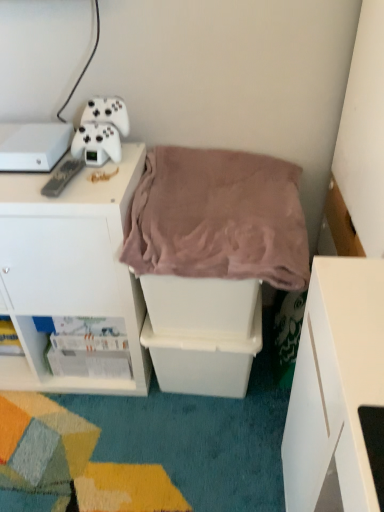
Question: From a real-world perspective, is white plastic storage bin at center, placed as the second shelf when sorted from left to right, physically located above or below white glossy magazine at lower left, the first shelf positioned from the left?

Choices:
 (A) below
 (B) above

Answer: (B)

Question: Considering the positions of white plastic storage bin at center, placed as the second shelf when sorted from left to right, and white glossy magazine at lower left, which ranks as the second shelf in right-to-left order, in the image, is white plastic storage bin at center, placed as the second shelf when sorted from left to right, wider or thinner than white glossy magazine at lower left, which ranks as the second shelf in right-to-left order,?

Choices:
 (A) thin
 (B) wide

Answer: (B)

Question: Estimate the real-world distances between objects in this image. Which object is farther from the white matte game controller at upper left?

Choices:
 (A) white plastic storage bin at center, the first shelf in the right-to-left sequence
 (B) black plastic remote at upper left
 (C) mauve plush blanket at center
 (D) white plastic cabinet at upper left
 (E) white glossy magazine at lower left, which ranks as the second shelf in right-to-left order

Answer: (A)

Question: Estimate the real-world distances between objects in this image. Which object is closer to the white matte game controller at upper left?

Choices:
 (A) white plastic cabinet at upper left
 (B) white plastic storage bin at center, placed as the second shelf when sorted from left to right
 (C) black plastic remote at upper left
 (D) white glossy magazine at lower left, the first shelf positioned from the left
 (E) mauve plush blanket at center

Answer: (C)